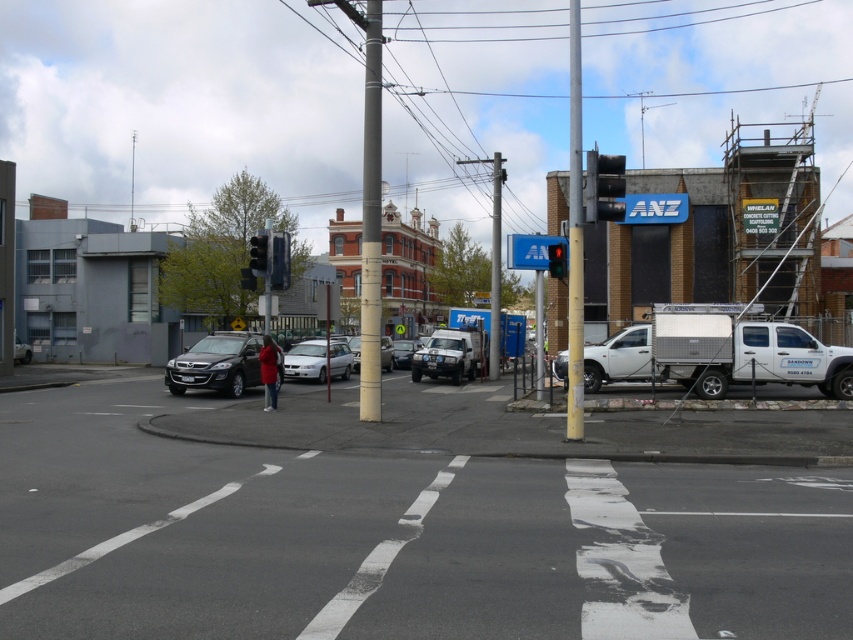
You are a pedestrian waiting at the curb and see both the metallic traffic light at center and the red glass traffic light at center. Which traffic light is closer to you?

The metallic traffic light at center is closer to you since the red glass traffic light at center is positioned behind it.

You are a delivery driver who needs to know which traffic light is shorter to avoid hitting your truck. Which traffic light is shorter between the metallic traffic light at center and the red glass traffic light at center?

The metallic traffic light at center is not as tall as the red glass traffic light at center, so the metallic traffic light at center is shorter.